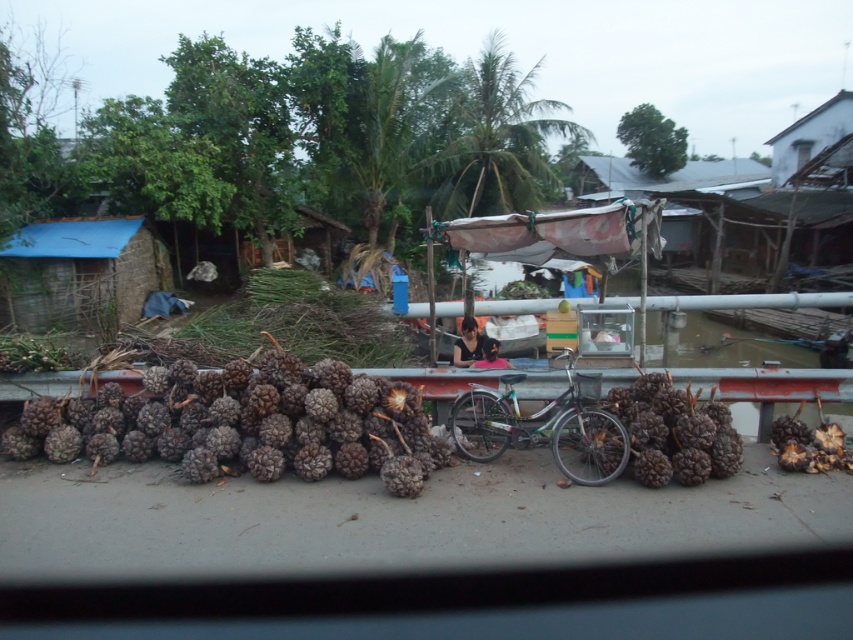
Is brown rough pinecones at center closer to camera compared to brown rough pinecones at right?

Yes, it is in front of brown rough pinecones at right.

Can you confirm if brown rough pinecones at center is positioned above brown rough pinecones at right?

Incorrect, brown rough pinecones at center is not positioned above brown rough pinecones at right.

Identify the location of brown rough pinecones at center. (242, 422).

Can you confirm if blue tarp at left is positioned to the left of metallic silver bicycle at center?

Correct, you'll find blue tarp at left to the left of metallic silver bicycle at center.

Is blue tarp at left below metallic silver bicycle at center?

Actually, blue tarp at left is above metallic silver bicycle at center.

Which is in front, point (126, 275) or point (461, 451)?

Point (461, 451)

Locate an element on the screen. Image resolution: width=853 pixels, height=640 pixels. blue tarp at left is located at coordinates (80, 273).

Measure the distance between metallic silver bicycle at center and brown rough pinecones at right.

20.22 inches

Is metallic silver bicycle at center below brown rough pinecones at right?

Yes.

Find the location of `metallic silver bicycle at center`. metallic silver bicycle at center is located at coordinates (544, 426).